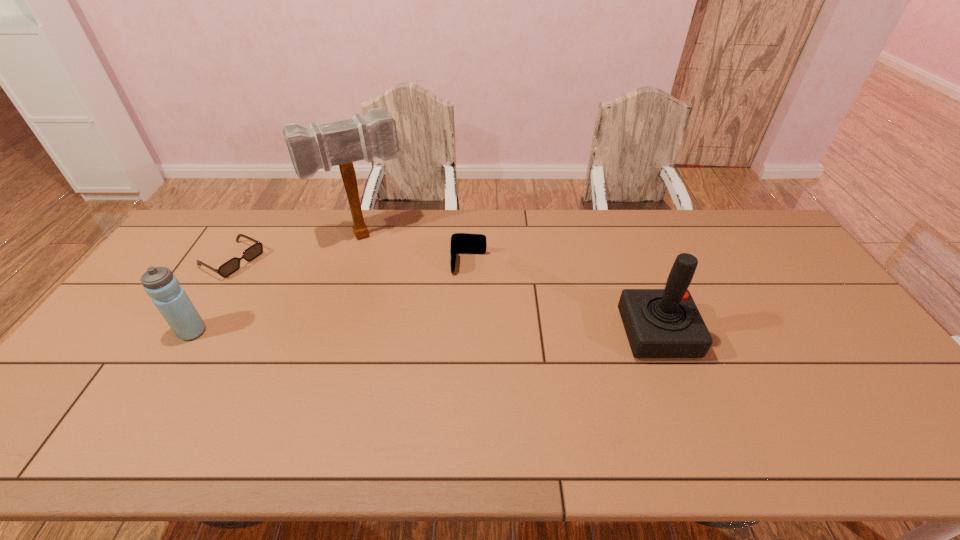
I want to click on empty location between the sunglasses and the third tallest object, so click(x=212, y=296).

This screenshot has width=960, height=540. What are the coordinates of `free area in between the shortest object and the water bottle` in the screenshot? It's located at (212, 296).

Where is `vacant region between the third shortest object and the sunglasses`? The width and height of the screenshot is (960, 540). vacant region between the third shortest object and the sunglasses is located at coordinates (212, 296).

At what (x,y) coordinates should I click in order to perform the action: click on vacant space in between the shortest object and the fourth object from left to right. Please return your answer as a coordinate pair (x, y). This screenshot has height=540, width=960. Looking at the image, I should click on (350, 262).

This screenshot has height=540, width=960. Identify the location of vacant area between the wallet and the third tallest object. (330, 298).

Find the location of `free space that is in between the sunglasses and the second object from right to left`. free space that is in between the sunglasses and the second object from right to left is located at coordinates (350, 262).

Locate an element on the screen. Image resolution: width=960 pixels, height=540 pixels. empty location between the shortest object and the fourth object from left to right is located at coordinates (350, 262).

You are a GUI agent. You are given a task and a screenshot of the screen. Output one action in this format:
    pyautogui.click(x=<x>, y=<y>)
    Task: Click on the second closest object to the tallest object
    
    Given the screenshot: What is the action you would take?
    pyautogui.click(x=461, y=243)

Find the location of a particular element. This screenshot has height=540, width=960. object that stands as the fourth closest to the water bottle is located at coordinates (659, 323).

Where is `free spot that satisfies the following two spatial constraints: 1. on the front side of the mallet; 2. on the base of the joystick`? free spot that satisfies the following two spatial constraints: 1. on the front side of the mallet; 2. on the base of the joystick is located at coordinates (333, 334).